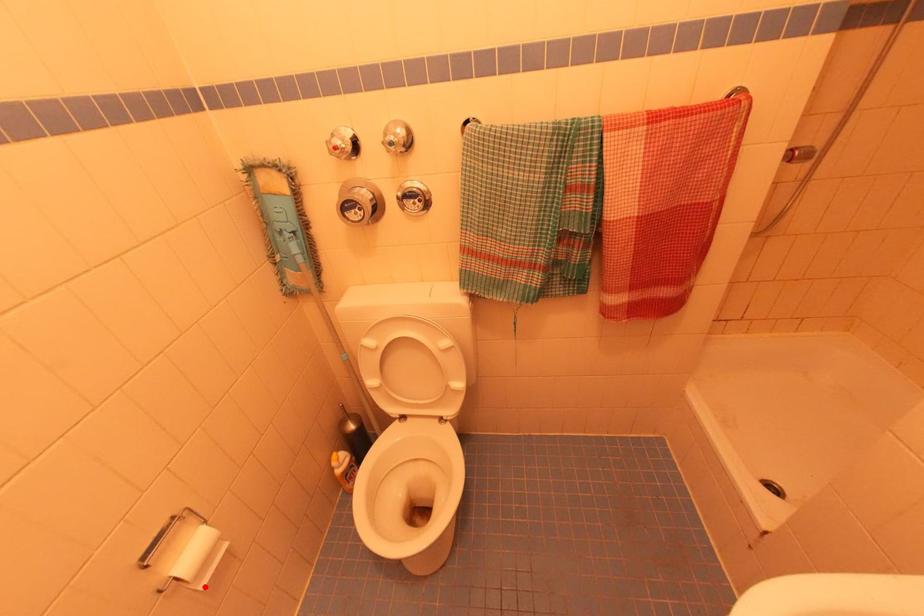
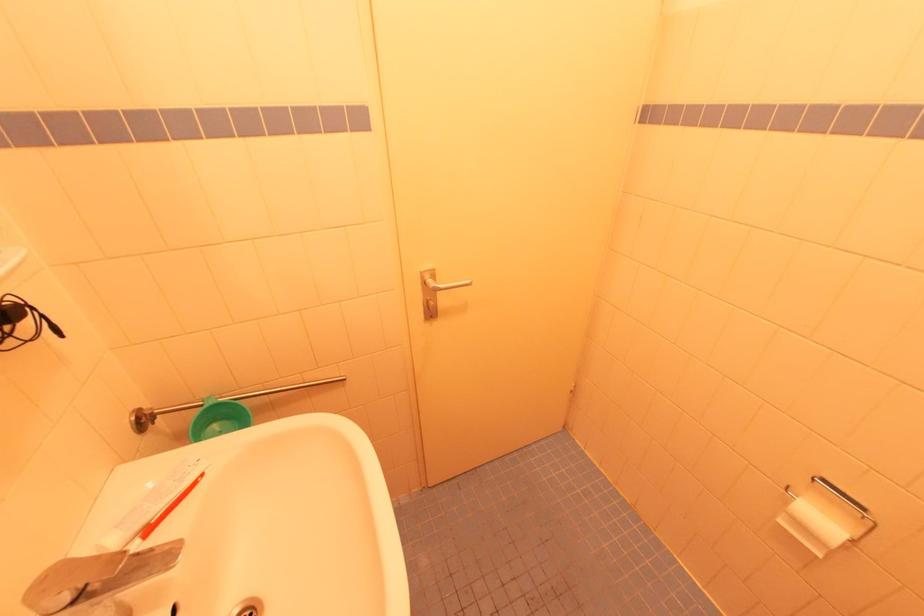
In the second image, find the point that corresponds to the highlighted location in the first image.

(784, 523)